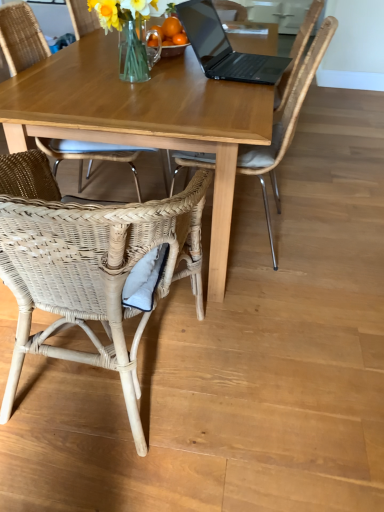
Image resolution: width=384 pixels, height=512 pixels. Describe the element at coordinates (128, 35) in the screenshot. I see `translucent glass vase at upper center` at that location.

The image size is (384, 512). What do you see at coordinates (224, 48) in the screenshot?
I see `black matte laptop at upper center` at bounding box center [224, 48].

The image size is (384, 512). I want to click on woven rattan chair at lower left, arranged as the second chair when viewed from the right, so pos(88,267).

Measure the distance between wooden table at center and woven rattan chair at lower left, arranged as the second chair when viewed from the right.

A distance of 13.82 inches exists between wooden table at center and woven rattan chair at lower left, arranged as the second chair when viewed from the right.

Considering the sizes of objects wooden table at center and woven rattan chair at lower left, which is the 2th chair in left-to-right order, in the image provided, who is smaller, wooden table at center or woven rattan chair at lower left, which is the 2th chair in left-to-right order,?

With smaller size is woven rattan chair at lower left, which is the 2th chair in left-to-right order.

How different are the orientations of wooden table at center and woven rattan chair at lower left, arranged as the second chair when viewed from the right, in degrees?

90.6 degrees.

Based on the photo, can woven rattan chair at lower left, arranged as the second chair when viewed from the right, be found inside wooden table at center?

Actually, woven rattan chair at lower left, arranged as the second chair when viewed from the right, is outside wooden table at center.

Would you say woven rattan chair at upper center, positioned as the third chair in left-to-right order, is outside wooden table at center?

No, woven rattan chair at upper center, positioned as the third chair in left-to-right order, is not entirely external to wooden table at center.

Considering the relative sizes of woven rattan chair at upper center, positioned as the third chair in left-to-right order, and wooden table at center in the image provided, is woven rattan chair at upper center, positioned as the third chair in left-to-right order, taller than wooden table at center?

Yes.

The height and width of the screenshot is (512, 384). Identify the location of coffee table below the woven rattan chair at upper center, the first chair when ordered from right to left (from a real-world perspective). (142, 117).

Does woven rattan chair at upper center, positioned as the third chair in left-to-right order, have a larger size compared to wooden table at center?

No.

Between point (129, 40) and point (323, 34), which one is positioned behind?

The point (129, 40) is farther.

What's the angular difference between translucent glass vase at upper center and woven rattan chair at upper center, the first chair when ordered from right to left,'s facing directions?

They differ by 175 degrees in their facing directions.

Between translucent glass vase at upper center and woven rattan chair at upper center, the first chair when ordered from right to left, which one has smaller size?

Smaller between the two is translucent glass vase at upper center.

In order to click on floral arrangement that is above the woven rattan chair at upper center, the first chair when ordered from right to left (from a real-world perspective) in this screenshot , I will do pos(128,35).

Is black matte laptop at upper center with woven rattan chair at upper center, positioned as the third chair in left-to-right order?

No, black matte laptop at upper center is not beside woven rattan chair at upper center, positioned as the third chair in left-to-right order.

In terms of width, does black matte laptop at upper center look wider or thinner when compared to woven rattan chair at upper center, positioned as the third chair in left-to-right order?

Considering their sizes, black matte laptop at upper center looks slimmer than woven rattan chair at upper center, positioned as the third chair in left-to-right order.

In the scene shown: From the image's perspective, which one is positioned higher, black matte laptop at upper center or woven rattan chair at upper center, positioned as the third chair in left-to-right order?

From the image's view, black matte laptop at upper center is above.

Which object is more forward, black matte laptop at upper center or wooden table at center?

wooden table at center is in front.

Which is closer to the camera, (199, 6) or (185, 114)?

The point (185, 114) is closer.

Can wooden table at center be found inside black matte laptop at upper center?

No, black matte laptop at upper center does not contain wooden table at center.

Can you confirm if black matte laptop at upper center is smaller than wooden table at center?

Yes, black matte laptop at upper center is smaller than wooden table at center.

Choose the correct answer: Is woven rattan chair at lower left, which is the 2th chair in left-to-right order, inside black matte laptop at upper center or outside it?

woven rattan chair at lower left, which is the 2th chair in left-to-right order, exists outside the volume of black matte laptop at upper center.

Could you tell me if woven rattan chair at lower left, which is the 2th chair in left-to-right order, is facing black matte laptop at upper center?

Yes.

Considering their positions, is woven rattan chair at lower left, arranged as the second chair when viewed from the right, located in front of or behind black matte laptop at upper center?

In the image, woven rattan chair at lower left, arranged as the second chair when viewed from the right, appears in front of black matte laptop at upper center.

Locate an element on the screen. laptop behind the woven rattan chair at lower left, arranged as the second chair when viewed from the right is located at coordinates (224, 48).

Is translucent glass vase at upper center far from woven rattan chair at lower left, which is the 2th chair in left-to-right order?

That's not correct — translucent glass vase at upper center is a little close to woven rattan chair at lower left, which is the 2th chair in left-to-right order.

Is woven rattan chair at lower left, which is the 2th chair in left-to-right order, completely or partially inside translucent glass vase at upper center?

No, translucent glass vase at upper center does not contain woven rattan chair at lower left, which is the 2th chair in left-to-right order.

Is translucent glass vase at upper center aimed at woven rattan chair at lower left, arranged as the second chair when viewed from the right?

No, translucent glass vase at upper center is not turned towards woven rattan chair at lower left, arranged as the second chair when viewed from the right.

Considering the relative positions of translucent glass vase at upper center and woven rattan chair at lower left, arranged as the second chair when viewed from the right, in the image provided, is translucent glass vase at upper center in front of woven rattan chair at lower left, arranged as the second chair when viewed from the right,?

No, it is behind woven rattan chair at lower left, arranged as the second chair when viewed from the right.

Where is `chair that is the 1st one when counting leftward from the wooden table at center`? chair that is the 1st one when counting leftward from the wooden table at center is located at coordinates (88, 267).

There is a wooden table at center. Where is `the 2nd chair above it (from a real-world perspective)`? the 2nd chair above it (from a real-world perspective) is located at coordinates (285, 125).

Which object lies nearer to the anchor point woven rattan chair at upper center, the first chair when ordered from right to left, wooden table at center or black matte laptop at upper center?

Based on the image, wooden table at center appears to be nearer to woven rattan chair at upper center, the first chair when ordered from right to left.

Which object lies nearer to the anchor point translucent glass vase at upper center, wooden table at center or woven rattan chair at lower left, arranged as the second chair when viewed from the right?

Among the two, wooden table at center is located nearer to translucent glass vase at upper center.

Estimate the real-world distances between objects in this image. Which object is further from black matte laptop at upper center, woven wicker chair at lower left, the third chair positioned from the right, or translucent glass vase at upper center?

Among the two, woven wicker chair at lower left, the third chair positioned from the right, is located further to black matte laptop at upper center.

From the image, which object appears to be nearer to woven rattan chair at lower left, arranged as the second chair when viewed from the right, black matte laptop at upper center or woven rattan chair at upper center, the first chair when ordered from right to left?

Among the two, woven rattan chair at upper center, the first chair when ordered from right to left, is located nearer to woven rattan chair at lower left, arranged as the second chair when viewed from the right.

Estimate the real-world distances between objects in this image. Which object is further from woven rattan chair at lower left, arranged as the second chair when viewed from the right, translucent glass vase at upper center or woven rattan chair at upper center, the first chair when ordered from right to left?

The object further to woven rattan chair at lower left, arranged as the second chair when viewed from the right, is translucent glass vase at upper center.

Based on their spatial positions, is woven rattan chair at upper center, the first chair when ordered from right to left, or wooden table at center further from black matte laptop at upper center?

wooden table at center is further to black matte laptop at upper center.

Based on their spatial positions, is translucent glass vase at upper center or woven rattan chair at upper center, the first chair when ordered from right to left, further from wooden table at center?

translucent glass vase at upper center lies further to wooden table at center than the other object.

Considering their positions, is black matte laptop at upper center positioned further to woven rattan chair at upper center, positioned as the third chair in left-to-right order, than woven rattan chair at lower left, which is the 2th chair in left-to-right order?

Based on the image, woven rattan chair at lower left, which is the 2th chair in left-to-right order, appears to be further to woven rattan chair at upper center, positioned as the third chair in left-to-right order.

Where is `floral arrangement located between woven wicker chair at lower left, the first chair in the left-to-right sequence, and wooden table at center in the left-right direction`? The image size is (384, 512). floral arrangement located between woven wicker chair at lower left, the first chair in the left-to-right sequence, and wooden table at center in the left-right direction is located at coordinates (128, 35).

The height and width of the screenshot is (512, 384). I want to click on coffee table between black matte laptop at upper center and woven rattan chair at upper center, the first chair when ordered from right to left, from top to bottom, so click(x=142, y=117).

Locate an element on the screen. The image size is (384, 512). chair that lies between woven wicker chair at lower left, the third chair positioned from the right, and woven rattan chair at lower left, which is the 2th chair in left-to-right order, from top to bottom is located at coordinates (285, 125).

What are the coordinates of `floral arrangement between woven wicker chair at lower left, the first chair in the left-to-right sequence, and woven rattan chair at upper center, the first chair when ordered from right to left, from left to right` in the screenshot? It's located at (128, 35).